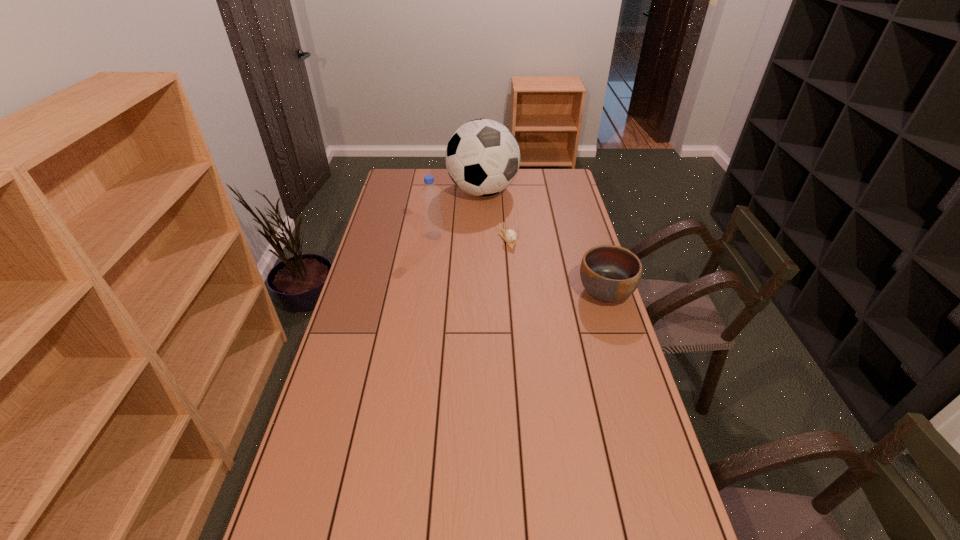
This screenshot has height=540, width=960. In order to click on free location located 0.370m on the main logo of the soccer ball in this screenshot , I will do `click(527, 257)`.

Identify the location of free space located on the shell of the shortest object. The image size is (960, 540). (523, 263).

Image resolution: width=960 pixels, height=540 pixels. Find the location of `free region located 0.180m on the shell of the shortest object`. free region located 0.180m on the shell of the shortest object is located at coordinates (534, 275).

I want to click on vacant region located on the shell of the shortest object, so 530,271.

This screenshot has width=960, height=540. Identify the location of object that is at the far edge. 482,157.

The height and width of the screenshot is (540, 960). Identify the location of object that is positioned at the right edge. (609, 273).

Identify the location of free space at the far edge. [466, 192].

Locate an element on the screen. Image resolution: width=960 pixels, height=540 pixels. free space at the near edge is located at coordinates (497, 505).

At what (x,y) coordinates should I click in order to perform the action: click on vacant region at the left edge of the desktop. Please return your answer as a coordinate pair (x, y). Image resolution: width=960 pixels, height=540 pixels. Looking at the image, I should click on coord(372,303).

Find the location of a particular element. The height and width of the screenshot is (540, 960). blank space at the right edge is located at coordinates (643, 475).